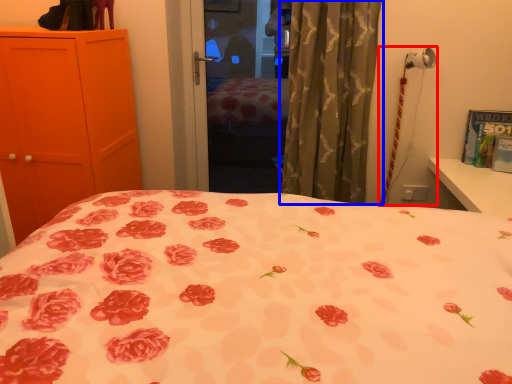
Question: Which object appears closest to the camera in this image, table lamp (highlighted by a red box) or curtain (highlighted by a blue box)?

Choices:
 (A) table lamp
 (B) curtain

Answer: (B)